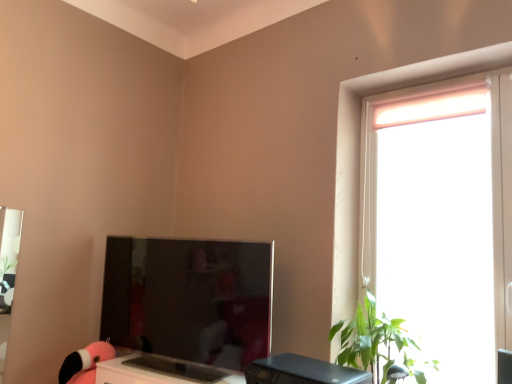
Question: From the image's perspective, is green leafy plant at right located above or below black plastic desktop at lower center?

Choices:
 (A) above
 (B) below

Answer: (A)

Question: Visually, is green leafy plant at right positioned to the left or to the right of black plastic desktop at lower center?

Choices:
 (A) right
 (B) left

Answer: (A)

Question: Based on their relative distances, which object is farther from the black plastic desktop at lower center?

Choices:
 (A) green leafy plant at right
 (B) satin black monitor at center
 (C) translucent plastic window at right
 (D) matte pink plush at lower left

Answer: (D)

Question: Estimate the real-world distances between objects in this image. Which object is closer to the black plastic desktop at lower center?

Choices:
 (A) satin black monitor at center
 (B) green leafy plant at right
 (C) translucent plastic window at right
 (D) matte pink plush at lower left

Answer: (B)